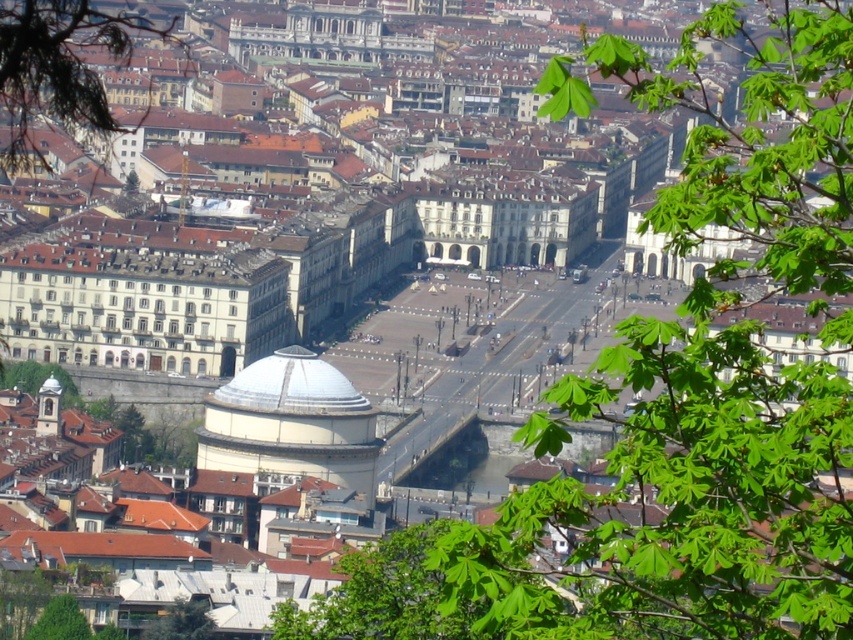
You are standing in the city square and want to reach both the point at coordinates point (675, 529) and point (201, 616). Which point should you head towards first if you want to reach the one that is closer to your current position?

You should head towards point (675, 529) first because it is closer to your current position than point (201, 616).

You are an urban planner assessing the city layout. You need to determine if the white matte dome at center can be seen from the green leafy tree at upper left. Based on their relative sizes, would the dome be visible from the tree?

The white matte dome at center has a lesser width compared to the green leafy tree at upper left. Since the dome is smaller in width, it might be obscured by the tree if they are positioned close. However, the dome is centrally located, so its elevated dome shape could still be visible above the tree canopy.